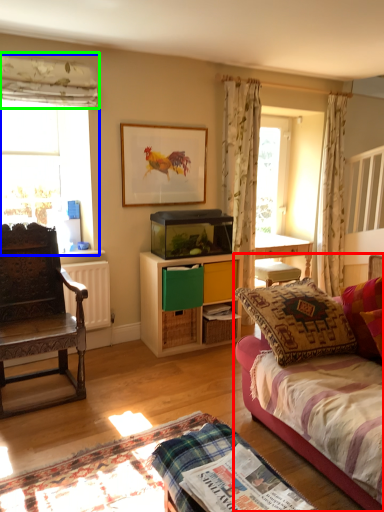
Question: Which object is the closest to the studio couch (highlighted by a red box)? Choose among these: window (highlighted by a blue box) or curtain (highlighted by a green box).

Choices:
 (A) window
 (B) curtain

Answer: (A)